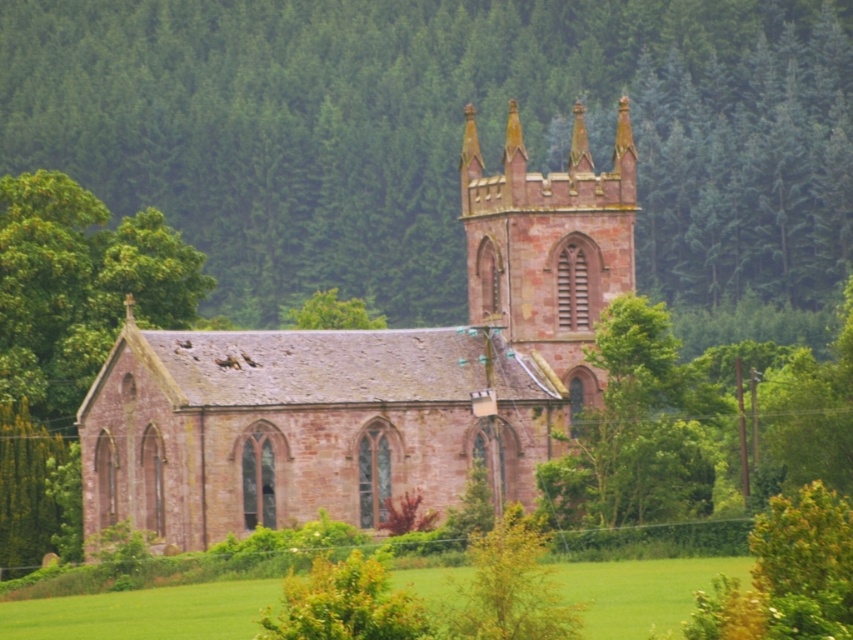
Between point (265, 404) and point (39, 611), which one is positioned in front?

Positioned in front is point (39, 611).

Is point (582, 300) positioned before point (624, 579)?

No, (582, 300) is behind (624, 579).

What do you see at coordinates (374, 372) in the screenshot? I see `rustic stone church at center` at bounding box center [374, 372].

This screenshot has height=640, width=853. In order to click on rustic stone church at center in this screenshot , I will do `click(374, 372)`.

Is point (740, 84) farther from viewer compared to point (216, 531)?

Yes, it is.

Looking at this image, does green leafy tree at center have a smaller size compared to rustic stone church at center?

Incorrect, green leafy tree at center is not smaller in size than rustic stone church at center.

Describe the element at coordinates (440, 132) in the screenshot. This screenshot has height=640, width=853. I see `green leafy tree at center` at that location.

At what (x,y) coordinates should I click in order to perform the action: click on green leafy tree at center. Please return your answer as a coordinate pair (x, y). Looking at the image, I should click on (440, 132).

Who is more distant from viewer, (210, 42) or (181, 634)?

The point (210, 42) is behind.

Does green leafy tree at center appear on the right side of green grass at lower center?

Incorrect, green leafy tree at center is not on the right side of green grass at lower center.

Is point (158, 8) farther from camera compared to point (235, 620)?

That is True.

You are a GUI agent. You are given a task and a screenshot of the screen. Output one action in this format:
    pyautogui.click(x=<x>, y=<y>)
    Task: Click on the green leafy tree at center
    
    Given the screenshot: What is the action you would take?
    pyautogui.click(x=440, y=132)